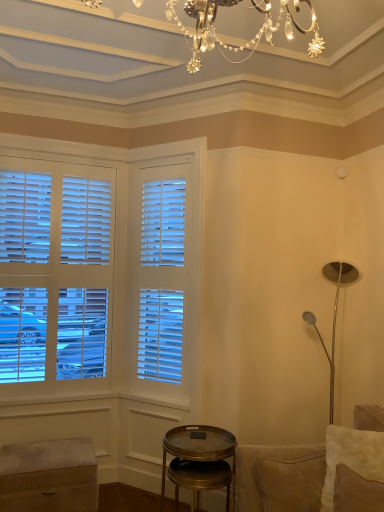
Question: Is suede couch at right next to metallic gold side table at lower center?

Choices:
 (A) no
 (B) yes

Answer: (A)

Question: Is suede couch at right further to the viewer compared to metallic gold side table at lower center?

Choices:
 (A) yes
 (B) no

Answer: (B)

Question: From a real-world perspective, is suede couch at right under metallic gold side table at lower center?

Choices:
 (A) no
 (B) yes

Answer: (A)

Question: From the image's perspective, is suede couch at right over metallic gold side table at lower center?

Choices:
 (A) no
 (B) yes

Answer: (B)

Question: Is suede couch at right closer to camera compared to metallic gold side table at lower center?

Choices:
 (A) no
 (B) yes

Answer: (B)

Question: Considering the positions of metallic gold side table at lower center and white fluffy pillow at lower right in the image, is metallic gold side table at lower center taller or shorter than white fluffy pillow at lower right?

Choices:
 (A) short
 (B) tall

Answer: (B)

Question: Choose the correct answer: Is metallic gold side table at lower center inside white fluffy pillow at lower right or outside it?

Choices:
 (A) outside
 (B) inside

Answer: (A)

Question: Relative to white fluffy pillow at lower right, is metallic gold side table at lower center in front or behind?

Choices:
 (A) front
 (B) behind

Answer: (B)

Question: Is metallic gold side table at lower center wider or thinner than white fluffy pillow at lower right?

Choices:
 (A) wide
 (B) thin

Answer: (A)

Question: Based on their positions, is metallic gold side table at lower center located to the left or right of suede couch at right?

Choices:
 (A) left
 (B) right

Answer: (A)

Question: Considering the positions of metallic gold side table at lower center and suede couch at right in the image, is metallic gold side table at lower center bigger or smaller than suede couch at right?

Choices:
 (A) big
 (B) small

Answer: (B)

Question: Considering the positions of metallic gold side table at lower center and suede couch at right in the image, is metallic gold side table at lower center taller or shorter than suede couch at right?

Choices:
 (A) short
 (B) tall

Answer: (A)

Question: Is metallic gold side table at lower center wider or thinner than suede couch at right?

Choices:
 (A) thin
 (B) wide

Answer: (A)

Question: Looking at their shapes, would you say suede couch at right is wider or thinner than white fluffy pillow at lower right?

Choices:
 (A) wide
 (B) thin

Answer: (A)

Question: Is suede couch at right to the left or to the right of white fluffy pillow at lower right in the image?

Choices:
 (A) right
 (B) left

Answer: (A)